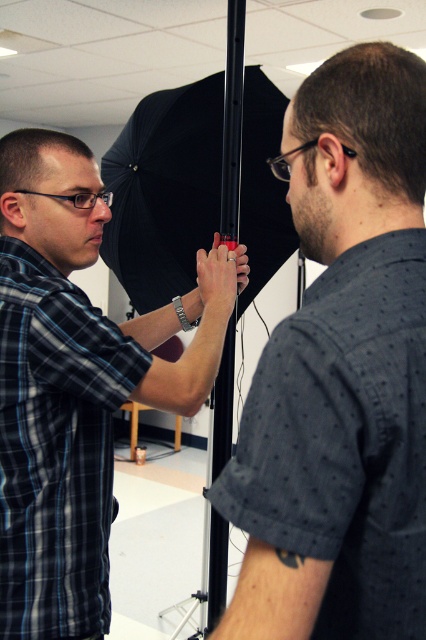
Is point (367, 609) positioned after point (51, 412)?

No, (367, 609) is in front of (51, 412).

Can you confirm if black matte pole at center is positioned to the right of plaid shirt at left?

Correct, you'll find black matte pole at center to the right of plaid shirt at left.

The width and height of the screenshot is (426, 640). Find the location of `black matte pole at center`. black matte pole at center is located at coordinates (342, 374).

Is black matte pole at center below black matte umbrella at center?

Yes, black matte pole at center is below black matte umbrella at center.

Does point (304, 596) come farther from viewer compared to point (167, 237)?

That is False.

Identify the location of black matte pole at center. (342, 374).

Identify the location of black matte pole at center. The width and height of the screenshot is (426, 640). (342, 374).

The height and width of the screenshot is (640, 426). What do you see at coordinates (77, 381) in the screenshot? I see `plaid shirt at left` at bounding box center [77, 381].

Based on the photo, is plaid shirt at left in front of black matte umbrella at center?

Yes, it is.

Describe the element at coordinates (77, 381) in the screenshot. I see `plaid shirt at left` at that location.

Where is `plaid shirt at left`? plaid shirt at left is located at coordinates (77, 381).